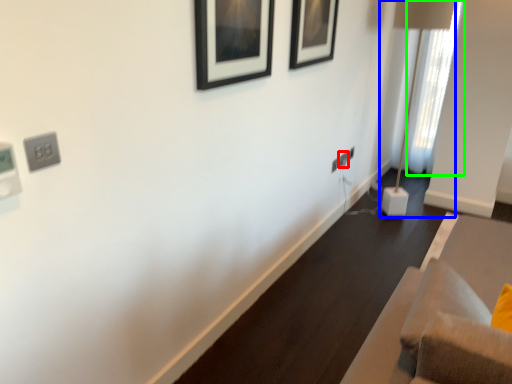
Question: Which is farther away from electric outlet (highlighted by a red box)? table lamp (highlighted by a blue box) or curtain (highlighted by a green box)?

Choices:
 (A) table lamp
 (B) curtain

Answer: (B)